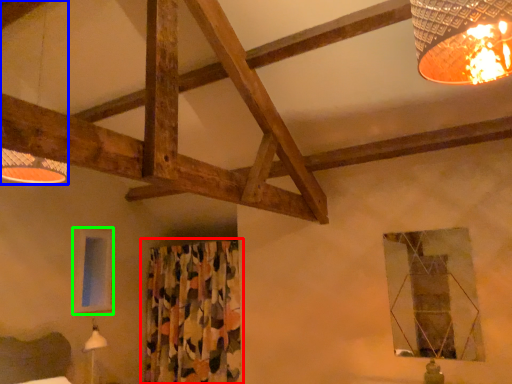
Question: Which is nearer to the curtain (highlighted by a red box)? lamp (highlighted by a blue box) or window (highlighted by a green box).

Choices:
 (A) lamp
 (B) window

Answer: (B)